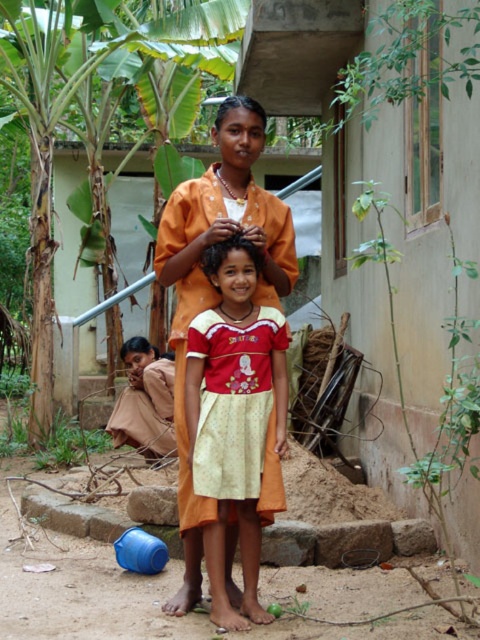
You are a photographer trying to capture a photo of the two girls without any obstructions. Based on the scene, will the green leafy banana tree at upper left block the view of the brown silky hair at upper center?

The green leafy banana tree at upper left is above the brown silky hair at upper center, so it will block the view of the brown silky hair at upper center when taking the photo.

You are a photographer trying to capture a clear shot of both the red cotton dress at center and the brown silky hair at upper center. Which object will appear larger in your photo?

The red cotton dress at center will appear larger in the photo because it is closer to the viewer than the brown silky hair at upper center.

You are a photographer trying to capture both the brown silky hair at center and the black shiny hair at upper center in a single frame. Which hair will appear smaller in the photo?

The brown silky hair at center will appear smaller in the photo because it has a smaller size compared to the black shiny hair at upper center.